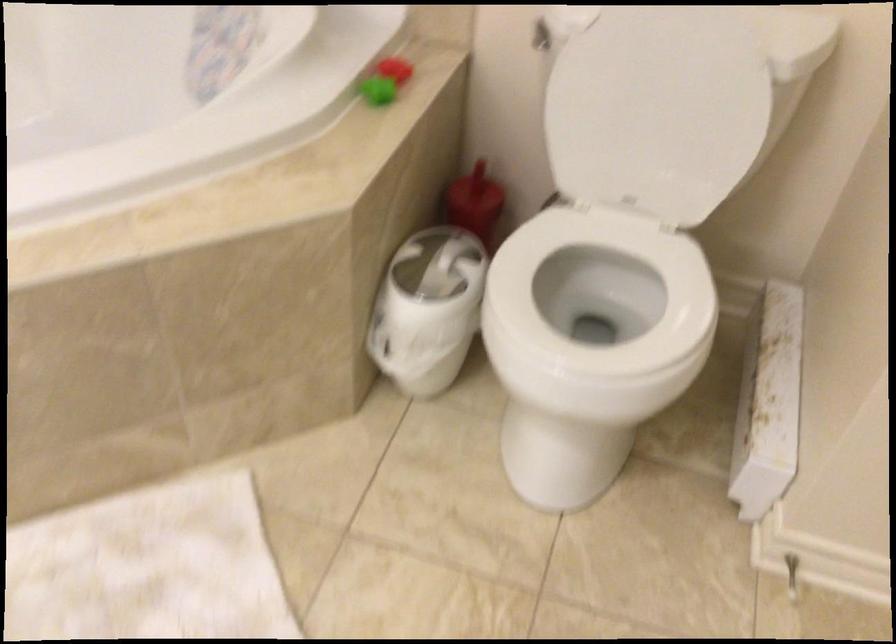
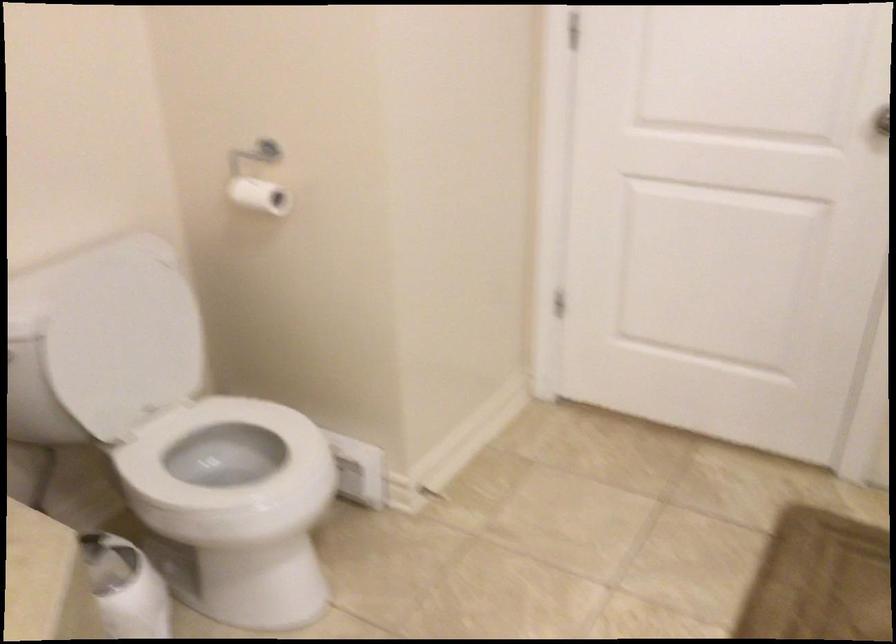
Find the pixel in the second image that matches (x=644, y=122) in the first image.

(122, 346)